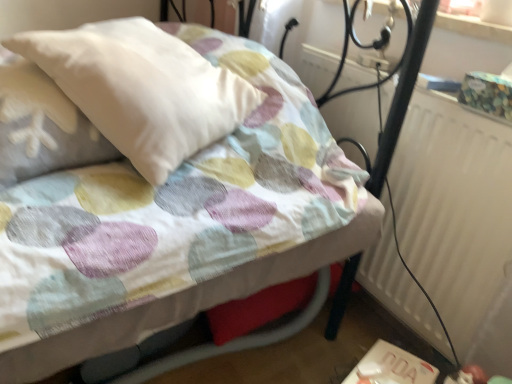
Question: Is white textured radiator at right at the right side of white soft pillow at upper left?

Choices:
 (A) yes
 (B) no

Answer: (A)

Question: Is white textured radiator at right thinner than white soft pillow at upper left?

Choices:
 (A) no
 (B) yes

Answer: (B)

Question: Can you confirm if white textured radiator at right is taller than white soft pillow at upper left?

Choices:
 (A) yes
 (B) no

Answer: (A)

Question: Is white textured radiator at right turned away from white soft pillow at upper left?

Choices:
 (A) no
 (B) yes

Answer: (A)

Question: Is white textured radiator at right further to camera compared to white soft pillow at upper left?

Choices:
 (A) yes
 (B) no

Answer: (A)

Question: Considering their positions, is white plastic table at lower right located in front of or behind white textured radiator at right?

Choices:
 (A) behind
 (B) front

Answer: (A)

Question: From the image's perspective, is white plastic table at lower right located above or below white textured radiator at right?

Choices:
 (A) below
 (B) above

Answer: (A)

Question: In terms of width, does white plastic table at lower right look wider or thinner when compared to white textured radiator at right?

Choices:
 (A) wide
 (B) thin

Answer: (A)

Question: Visually, is white plastic table at lower right positioned to the left or to the right of white textured radiator at right?

Choices:
 (A) right
 (B) left

Answer: (B)

Question: Does point (76, 100) appear closer or farther from the camera than point (365, 369)?

Choices:
 (A) closer
 (B) farther

Answer: (A)

Question: In terms of height, does white soft pillow at upper left look taller or shorter compared to white plastic table at lower right?

Choices:
 (A) tall
 (B) short

Answer: (A)

Question: From a real-world perspective, is white soft pillow at upper left positioned above or below white plastic table at lower right?

Choices:
 (A) below
 (B) above

Answer: (B)

Question: Would you say white soft pillow at upper left is to the left or to the right of white plastic table at lower right in the picture?

Choices:
 (A) left
 (B) right

Answer: (A)

Question: Is white textured radiator at right inside the boundaries of white soft pillow at upper left, or outside?

Choices:
 (A) outside
 (B) inside

Answer: (A)

Question: From the image's perspective, is white textured radiator at right above or below white soft pillow at upper left?

Choices:
 (A) above
 (B) below

Answer: (B)